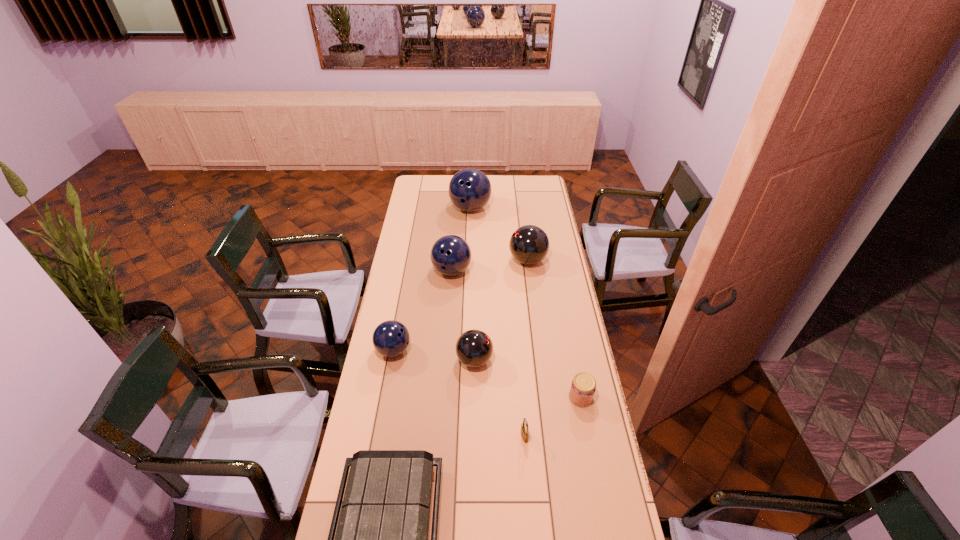
Identify the location of vacant space located 0.310m on the front of the jam. The height and width of the screenshot is (540, 960). (600, 499).

At what (x,y) coordinates should I click in order to perform the action: click on free space located on the back of the padlock. Please return your answer as a coordinate pair (x, y). Looking at the image, I should click on (520, 387).

In order to click on object positioned at the left edge in this screenshot , I will do `click(391, 338)`.

Image resolution: width=960 pixels, height=540 pixels. I want to click on bowling ball located at the right edge, so tap(529, 244).

Image resolution: width=960 pixels, height=540 pixels. I want to click on jam present at the right edge, so click(582, 390).

This screenshot has width=960, height=540. I want to click on free region at the left edge, so click(409, 210).

Find the location of a particular element. Image resolution: width=960 pixels, height=540 pixels. vacant point at the right edge is located at coordinates (570, 338).

What are the coordinates of `free region at the far right corner` in the screenshot? It's located at (547, 190).

This screenshot has height=540, width=960. What are the coordinates of `unoccupied area between the brass padlock and the nearest blue bowling ball` in the screenshot? It's located at (459, 393).

Where is `empty space that is in between the right black bowling ball and the leftmost blue bowling ball`? The height and width of the screenshot is (540, 960). empty space that is in between the right black bowling ball and the leftmost blue bowling ball is located at coordinates (461, 305).